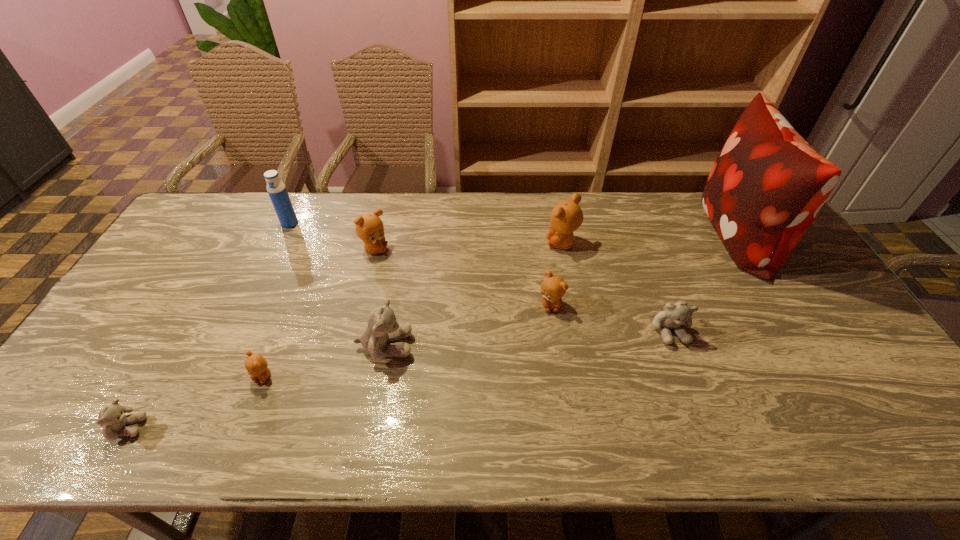
Find the location of a particular element. The height and width of the screenshot is (540, 960). the fourth closest object to the second teddy bear from left to right is located at coordinates (276, 189).

The image size is (960, 540). Identify the location of object that is the fifth closest to the second brown teddy bear from left to right. (566, 217).

Locate which teddy bear ranks third in proximity to the eighth object from right to left. Please provide its 2D coordinates. Your answer should be formatted as a tuple, i.e. [(x, y)], where the tuple contains the x and y coordinates of a point satisfying the conditions above.

[(256, 365)]

You are a GUI agent. You are given a task and a screenshot of the screen. Output one action in this format:
    pyautogui.click(x=<x>, y=<y>)
    Task: Click on the teddy bear object that ranks as the closest to the biggest brown teddy bear
    
    Given the screenshot: What is the action you would take?
    pyautogui.click(x=553, y=288)

Point out which brown teddy bear is positioned as the nearest to the third smallest brown teddy bear. Please provide its 2D coordinates. Your answer should be formatted as a tuple, i.e. [(x, y)], where the tuple contains the x and y coordinates of a point satisfying the conditions above.

[(256, 365)]

Identify the location of brown teddy bear that is the closest to the leftmost gray teddy bear. The width and height of the screenshot is (960, 540). (256, 365).

Image resolution: width=960 pixels, height=540 pixels. Identify the location of gray teddy bear that is the second closest one to the rightmost gray teddy bear. (112, 417).

This screenshot has width=960, height=540. Identify the location of gray teddy bear that can be found as the closest to the rightmost gray teddy bear. (382, 327).

Locate an element on the screen. free space that satisfies the following two spatial constraints: 1. on the face of the third farthest brown teddy bear; 2. on the face of the biggest gray teddy bear is located at coordinates (557, 346).

Find the location of `vacant space that satisfies the following two spatial constraints: 1. on the front-facing side of the rightmost object; 2. on the face of the leftmost brown teddy bear`. vacant space that satisfies the following two spatial constraints: 1. on the front-facing side of the rightmost object; 2. on the face of the leftmost brown teddy bear is located at coordinates (824, 376).